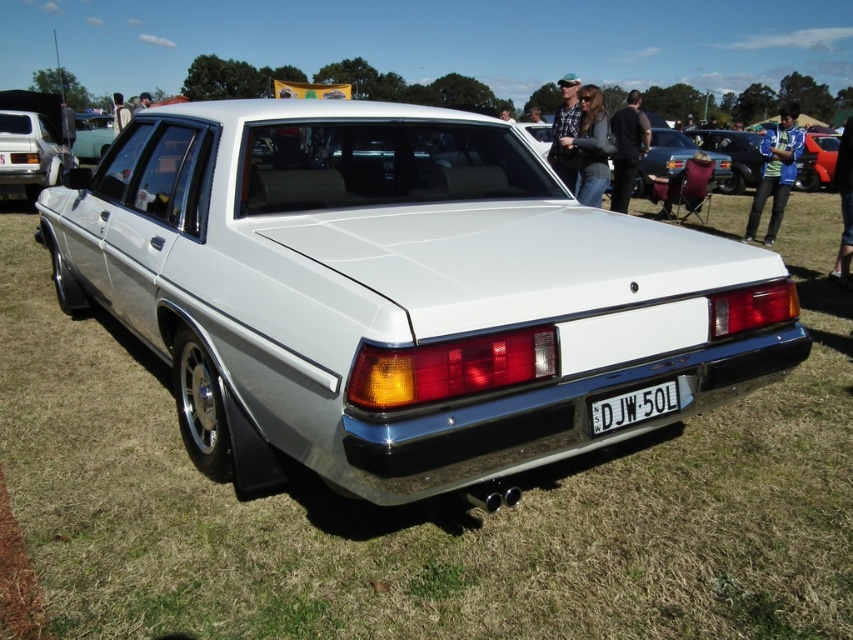
Question: Which point is closer to the camera?

Choices:
 (A) (178, 305)
 (B) (601, 429)

Answer: (B)

Question: Which point appears farthest from the camera in this image?

Choices:
 (A) (18, 161)
 (B) (264, 236)
 (C) (614, 400)

Answer: (A)

Question: Can you confirm if matte white sedan at left is positioned to the right of black plastic license plate at center?

Choices:
 (A) yes
 (B) no

Answer: (B)

Question: Is matte white sedan at left thinner than matte white sedan at center?

Choices:
 (A) no
 (B) yes

Answer: (B)

Question: From the image, what is the correct spatial relationship of white glossy sedan at center in relation to matte white sedan at left?

Choices:
 (A) right
 (B) left

Answer: (A)

Question: Which is nearer to the matte white sedan at center?

Choices:
 (A) black plastic license plate at center
 (B) white glossy sedan at center
 (C) matte white sedan at left

Answer: (C)